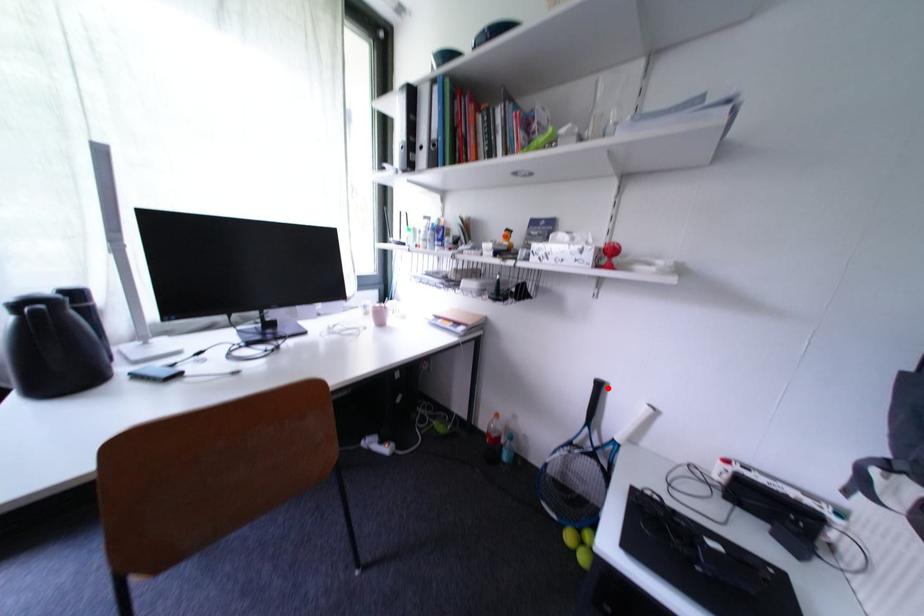
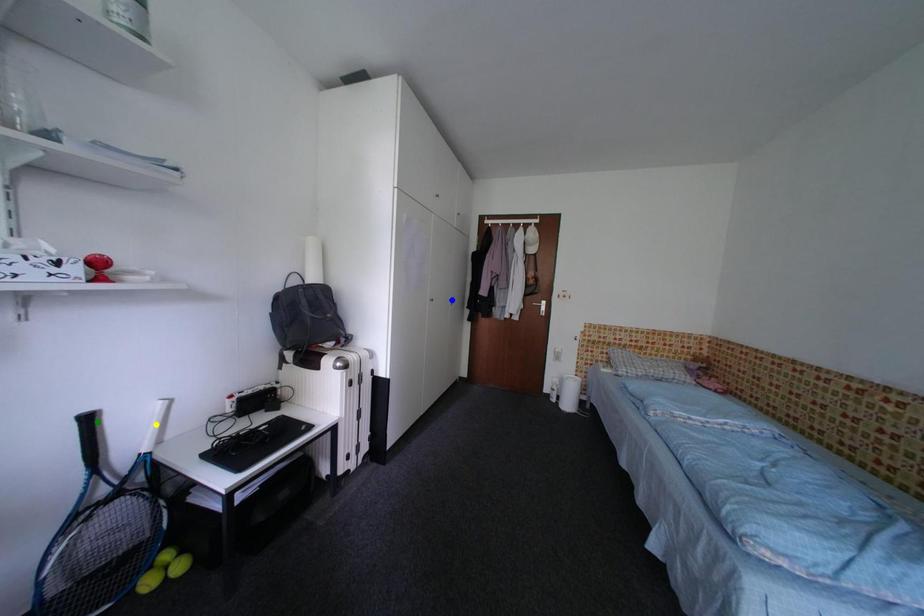
Question: I am providing you with two images of the same scene from different viewpoints. A red point is marked on the first image. You are given multiple points on the second image. Which point in image 2 represents the same 3d spot as the red point in image 1?

Choices:
 (A) yellow point
 (B) green point
 (C) blue point

Answer: (B)